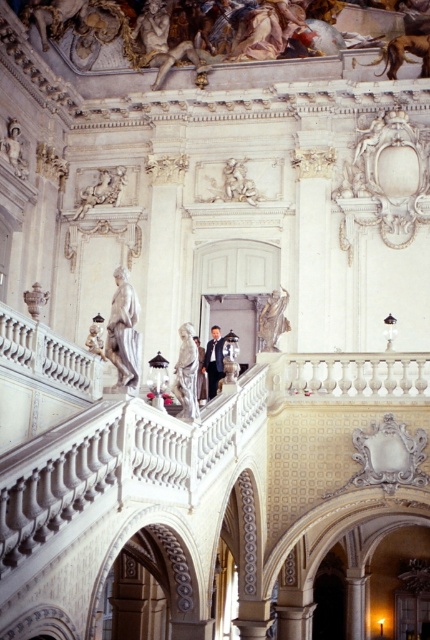
Can you confirm if matte white statue at upper center is bigger than matte white vase at upper left?

No, matte white statue at upper center is not bigger than matte white vase at upper left.

From the picture: Does matte white statue at upper center have a lesser height compared to matte white vase at upper left?

No, matte white statue at upper center is not shorter than matte white vase at upper left.

Is point (267, 346) farther from camera compared to point (33, 300)?

No, it is in front of (33, 300).

At what (x,y) coordinates should I click in order to perform the action: click on matte white statue at upper center. Please return your answer as a coordinate pair (x, y). Looking at the image, I should click on (273, 320).

Who is more forward, [273,298] or [214,353]?

Point [273,298] is in front.

Which is behind, point (285, 305) or point (206, 348)?

The point (206, 348) is more distant.

Who is more distant from viewer, (261,317) or (212,362)?

Point (212,362)

The width and height of the screenshot is (430, 640). Find the location of `matte white statue at upper center`. matte white statue at upper center is located at coordinates (273, 320).

From the picture: Which of these two, white marble statue at upper left or matte white statue at upper left, stands taller?

With more height is white marble statue at upper left.

Looking at this image, can you confirm if white marble statue at upper left is shorter than matte white statue at upper left?

No.

Which is behind, point (138, 369) or point (5, 140)?

Point (5, 140)

Locate an element on the screen. The width and height of the screenshot is (430, 640). white marble statue at upper left is located at coordinates (123, 332).